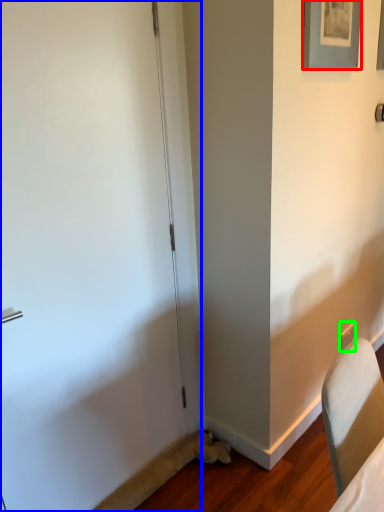
Question: Which object is positioned closest to picture frame (highlighted by a red box)? Select from door (highlighted by a blue box) and electric outlet (highlighted by a green box).

Choices:
 (A) door
 (B) electric outlet

Answer: (A)